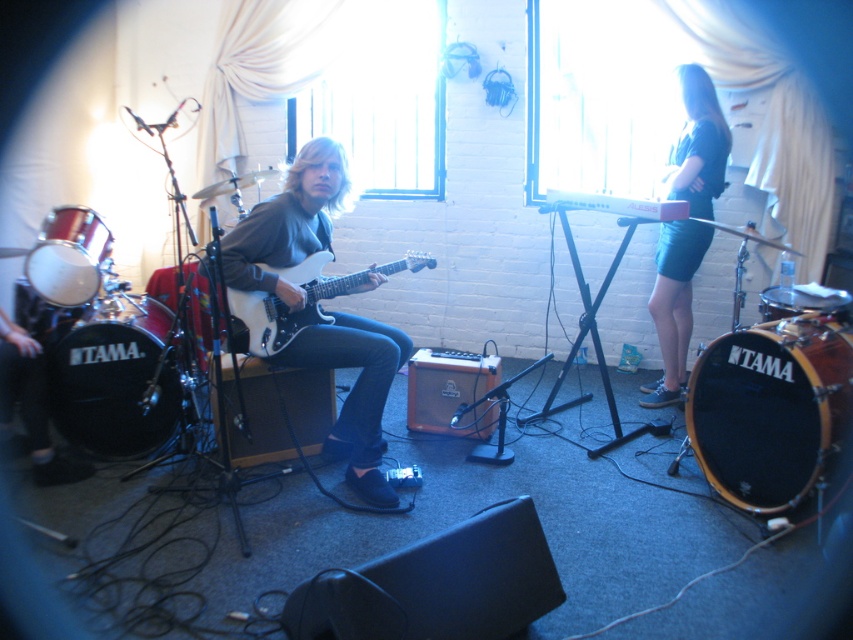
Question: Which object is farther from the camera taking this photo?

Choices:
 (A) wooden drum at right
 (B) black wood drum at lower right
 (C) matte white guitar at center

Answer: (A)

Question: Is dark blue skirt at right positioned before glossy white electric guitar at center?

Choices:
 (A) yes
 (B) no

Answer: (B)

Question: Where is black drum at left located in relation to glossy white electric guitar at center in the image?

Choices:
 (A) above
 (B) below

Answer: (B)

Question: Can you confirm if black wood drum at lower right is bigger than matte black drum at left?

Choices:
 (A) no
 (B) yes

Answer: (B)

Question: Which object is closer to the camera taking this photo?

Choices:
 (A) glossy white electric guitar at center
 (B) matte black drum at left

Answer: (A)

Question: Which object appears farthest from the camera in this image?

Choices:
 (A) wooden drum at right
 (B) black wood drum at lower right
 (C) glossy white electric guitar at center
 (D) black drum at left

Answer: (D)